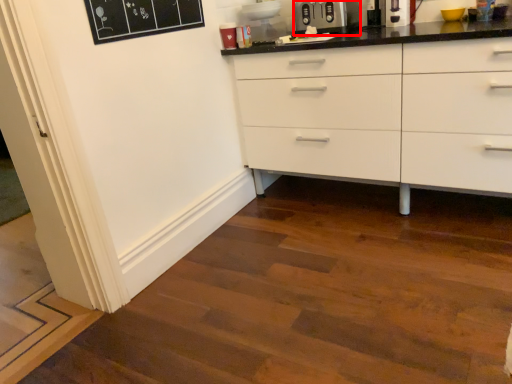
Question: From the image's perspective, where is appliance (annotated by the red box) located relative to coffee machine?

Choices:
 (A) below
 (B) above

Answer: (A)